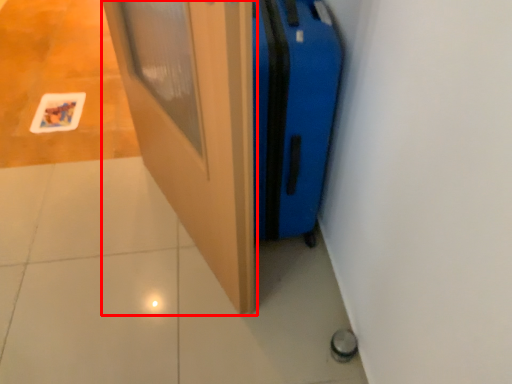
Question: Where is door (annotated by the red box) located in relation to luggage in the image?

Choices:
 (A) left
 (B) right

Answer: (A)